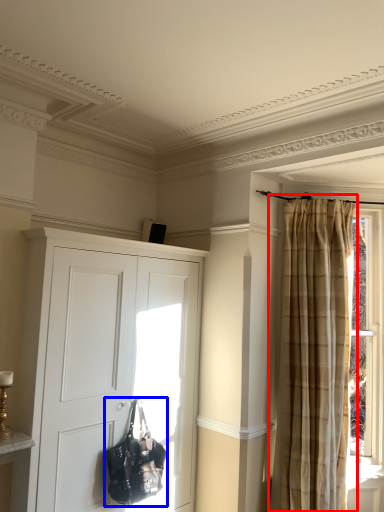
Question: Which object appears closest to the camera in this image, curtain (highlighted by a red box) or handbag (highlighted by a blue box)?

Choices:
 (A) curtain
 (B) handbag

Answer: (B)